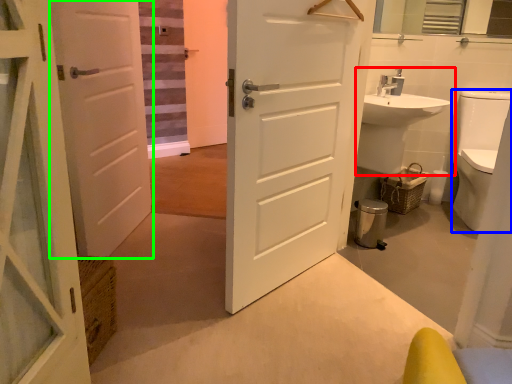
Question: Estimate the real-world distances between objects in this image. Which object is farther from sink (highlighted by a red box), toilet bowl (highlighted by a blue box) or door (highlighted by a green box)?

Choices:
 (A) toilet bowl
 (B) door

Answer: (B)